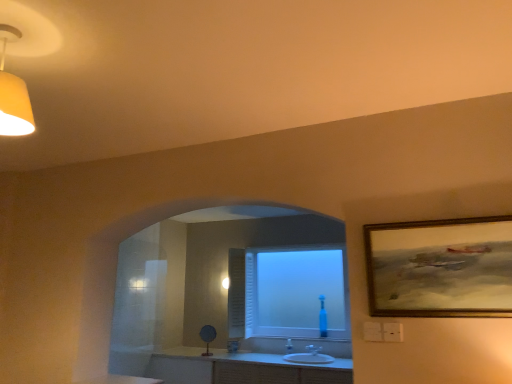
Measure the distance between point (126, 382) and camera.

Point (126, 382) and camera are 3.66 meters apart from each other.

Locate an element on the screen. The width and height of the screenshot is (512, 384). white glossy counter top at lower center is located at coordinates (121, 380).

Image resolution: width=512 pixels, height=384 pixels. Describe the element at coordinates (293, 292) in the screenshot. I see `frosted glass window at center` at that location.

At what (x,y) coordinates should I click in order to perform the action: click on gold-framed painting at upper right. Please return your answer as a coordinate pair (x, y). The image size is (512, 384). Looking at the image, I should click on (440, 268).

From the picture: Which point is more forward, (x=335, y=281) or (x=289, y=361)?

The point (x=289, y=361) is closer to the camera.

Is frosted glass window at center placed right next to white glossy sink at center?

They are not placed beside each other.

Consider the image. Is frosted glass window at center bigger or smaller than white glossy sink at center?

In the image, frosted glass window at center appears to be larger than white glossy sink at center.

From the picture: Is frosted glass window at center not within gold-framed painting at upper right?

That's correct, frosted glass window at center is outside of gold-framed painting at upper right.

Considering the positions of objects frosted glass window at center and gold-framed painting at upper right in the image provided, who is more to the right, frosted glass window at center or gold-framed painting at upper right?

Positioned to the right is gold-framed painting at upper right.

Between frosted glass window at center and gold-framed painting at upper right, which one has larger width?

Wider between the two is frosted glass window at center.

Is gold-framed painting at upper right not close to white glossy sink at center?

Yes, gold-framed painting at upper right and white glossy sink at center are quite far apart.

Which point is more forward, [483,231] or [307,357]?

The point [483,231] is closer.

From a real-world perspective, between gold-framed painting at upper right and white glossy sink at center, who is vertically higher?

gold-framed painting at upper right is physically above.

Is white glossy counter top at lower center looking in the opposite direction of gold-framed painting at upper right?

No, white glossy counter top at lower center's orientation is not away from gold-framed painting at upper right.

Between point (81, 382) and point (490, 261), which one is positioned behind?

The point (81, 382) is farther from the camera.

From a real-world perspective, which is physically above, white glossy counter top at lower center or gold-framed painting at upper right?

gold-framed painting at upper right, from a real-world perspective.

Is white glossy counter top at lower center to the left or to the right of gold-framed painting at upper right in the image?

white glossy counter top at lower center is to the left of gold-framed painting at upper right.

How distant is white glossy sink at center from white glossy counter top at lower center?

white glossy sink at center and white glossy counter top at lower center are 1.61 meters apart from each other.

From the image's perspective, relative to white glossy counter top at lower center, is white glossy sink at center above or below?

From the image's perspective, white glossy sink at center appears below white glossy counter top at lower center.

From a real-world perspective, which is physically below, white glossy sink at center or white glossy counter top at lower center?

white glossy sink at center.

Based on their sizes in the image, would you say white glossy sink at center is bigger or smaller than white glossy counter top at lower center?

Considering their sizes, white glossy sink at center takes up more space than white glossy counter top at lower center.

Is white glossy sink at center to the left of gold-framed painting at upper right from the viewer's perspective?

Correct, you'll find white glossy sink at center to the left of gold-framed painting at upper right.

Does white glossy sink at center have a lesser height compared to gold-framed painting at upper right?

Yes.

Is white glossy sink at center situated inside gold-framed painting at upper right or outside?

white glossy sink at center is not enclosed by gold-framed painting at upper right.

Based on the photo, from the image's perspective, is white glossy sink at center located above gold-framed painting at upper right?

No, from the image's perspective, white glossy sink at center is not above gold-framed painting at upper right.

Identify the location of sink that appears below the frosted glass window at center (from the image's perspective). (309, 356).

Can you confirm if white glossy sink at center is thinner than frosted glass window at center?

No, white glossy sink at center is not thinner than frosted glass window at center.

Choose the correct answer: Is white glossy sink at center inside frosted glass window at center or outside it?

white glossy sink at center is outside frosted glass window at center.

In the image, there is a frosted glass window at center. Identify the location of sink below it (from the image's perspective). (309, 356).

Where is `window below the gold-framed painting at upper right (from a real-world perspective)`? The image size is (512, 384). window below the gold-framed painting at upper right (from a real-world perspective) is located at coordinates (293, 292).

Considering their positions, is white glossy sink at center positioned closer to frosted glass window at center than white glossy counter top at lower center?

Among the two, white glossy sink at center is located nearer to frosted glass window at center.

Looking at the image, which one is located closer to gold-framed painting at upper right, white glossy sink at center or frosted glass window at center?

Based on the image, white glossy sink at center appears to be nearer to gold-framed painting at upper right.

Based on their spatial positions, is gold-framed painting at upper right or white glossy sink at center closer to white glossy counter top at lower center?

white glossy sink at center lies closer to white glossy counter top at lower center than the other object.

Based on the photo, considering their positions, is frosted glass window at center positioned further to gold-framed painting at upper right than white glossy sink at center?

frosted glass window at center lies further to gold-framed painting at upper right than the other object.

Based on their spatial positions, is frosted glass window at center or white glossy sink at center closer to white glossy counter top at lower center?

white glossy sink at center.

Which object lies nearer to the anchor point white glossy counter top at lower center, white glossy sink at center or gold-framed painting at upper right?

Among the two, white glossy sink at center is located nearer to white glossy counter top at lower center.

Estimate the real-world distances between objects in this image. Which object is further from white glossy sink at center, gold-framed painting at upper right or frosted glass window at center?

gold-framed painting at upper right.

Which object lies nearer to the anchor point frosted glass window at center, gold-framed painting at upper right or white glossy counter top at lower center?

white glossy counter top at lower center is closer to frosted glass window at center.

The height and width of the screenshot is (384, 512). In order to click on sink between gold-framed painting at upper right and frosted glass window at center in the front-back direction in this screenshot , I will do `click(309, 356)`.

This screenshot has width=512, height=384. Identify the location of counter top located between gold-framed painting at upper right and white glossy sink at center in the depth direction. (121, 380).

The width and height of the screenshot is (512, 384). What are the coordinates of `sink positioned between white glossy counter top at lower center and frosted glass window at center from near to far` in the screenshot? It's located at (309, 356).

The width and height of the screenshot is (512, 384). I want to click on counter top positioned between gold-framed painting at upper right and frosted glass window at center from near to far, so click(x=121, y=380).